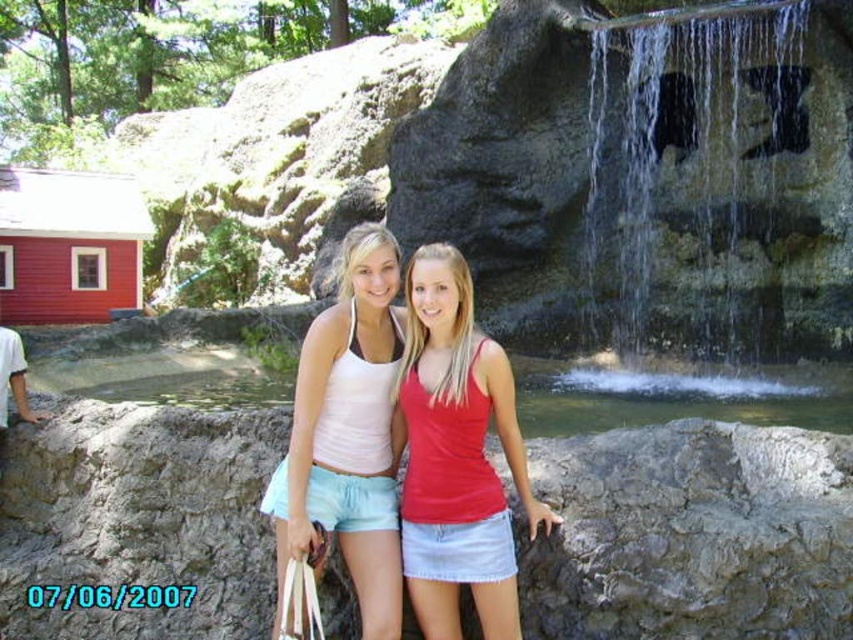
You are a photographer trying to capture the two people in the scene. Since the clear water at center right and the matte red tank top at center are both in the frame, which object is closer to the camera?

The clear water at center right is closer to the camera than the matte red tank top at center because it is further to the viewer.

You are taking a photo of the two people in the scene. The camera you are using has a focus setting that can only focus on objects in front of others. Which object should you focus on to ensure the matte white tank top at center is in focus while the clear water at center right is blurred?

To ensure the matte white tank top at center is in focus while the clear water at center right is blurred, you should focus on the matte white tank top at center since it is behind the clear water at center right. By focusing on the matte white tank top at center, the camera will blur the foreground object, which is the clear water at center right.